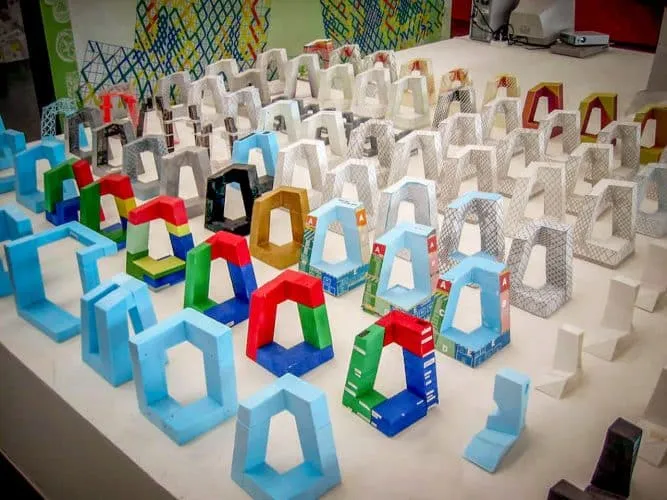
In order to click on red wall in this screenshot , I will do `click(635, 11)`.